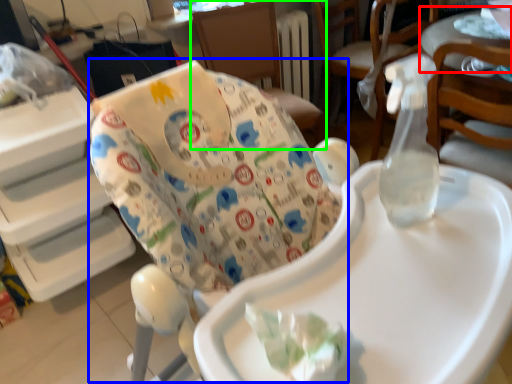
Question: Estimate the real-world distances between objects in this image. Which object is farther from table (highlighted by a red box), rocking chair (highlighted by a blue box) or chair (highlighted by a green box)?

Choices:
 (A) rocking chair
 (B) chair

Answer: (A)